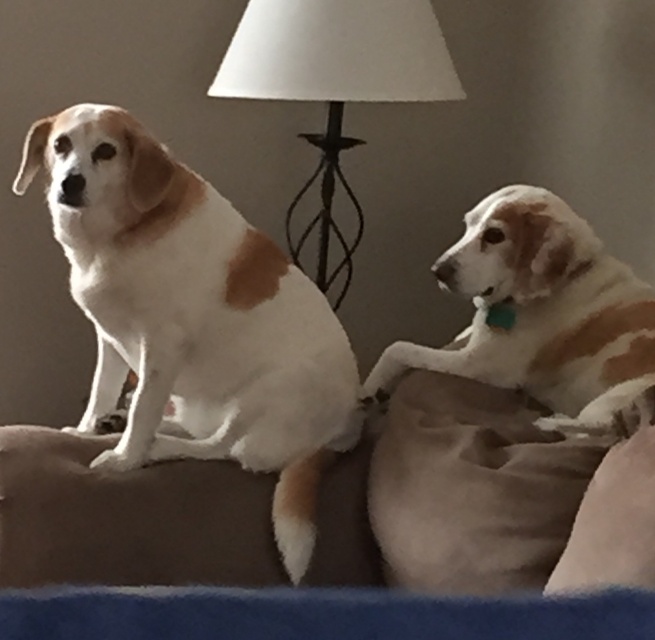
Question: From the image, what is the correct spatial relationship of white fur dog at left in relation to white matte lampshade at center?

Choices:
 (A) above
 (B) below

Answer: (B)

Question: Can you confirm if soft suede pillow at lower right is positioned above white fur dog at right?

Choices:
 (A) no
 (B) yes

Answer: (A)

Question: Which point is closer to the camera?

Choices:
 (A) (422, 540)
 (B) (489, 604)

Answer: (B)

Question: Which object is closer to the camera taking this photo?

Choices:
 (A) white matte lampshade at center
 (B) blue fabric dog bed at lower center
 (C) white fur dog at left

Answer: (B)

Question: Is soft suede pillow at lower right positioned before blue fabric dog bed at lower center?

Choices:
 (A) yes
 (B) no

Answer: (B)

Question: Among these objects, which one is nearest to the camera?

Choices:
 (A) white fur dog at right
 (B) white fur dog at left
 (C) blue fabric dog bed at lower center
 (D) soft suede pillow at lower right

Answer: (C)